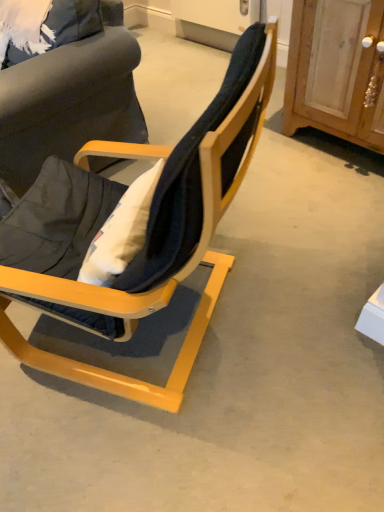
Measure the distance between point (217, 155) and camera.

The depth of point (217, 155) is 27.60 inches.

Identify the location of wooden rocking chair at center. (141, 256).

Image resolution: width=384 pixels, height=512 pixels. What do you see at coordinates (141, 256) in the screenshot? I see `wooden rocking chair at center` at bounding box center [141, 256].

Find the location of a particular element. wooden rocking chair at center is located at coordinates (141, 256).